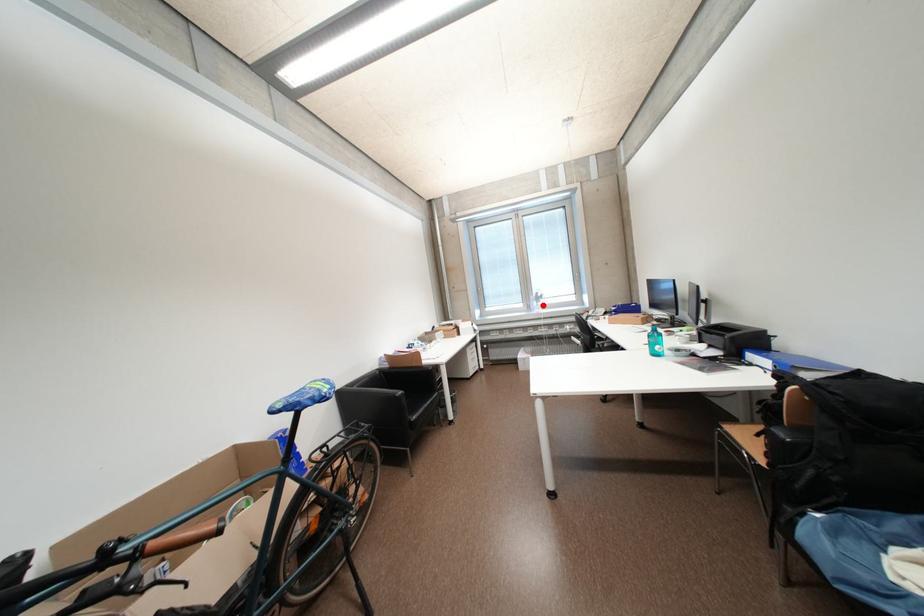
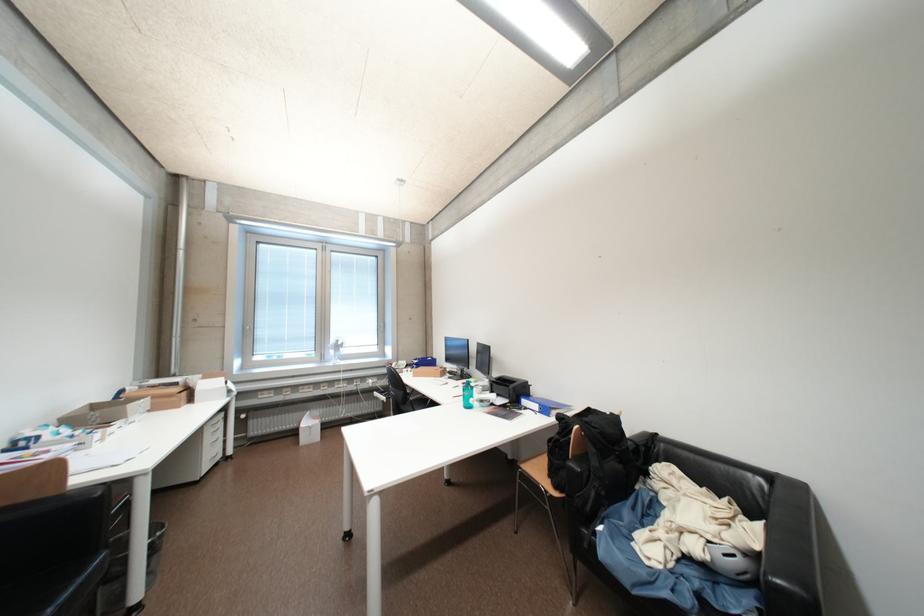
Question: I am providing you with two images of the same scene from different viewpoints. A red point is marked on the first image. Can you still see the location of the red point in image 2?

Choices:
 (A) Yes
 (B) No

Answer: (A)